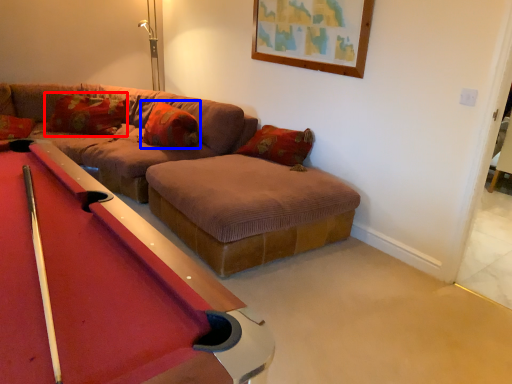
Question: Among these objects, which one is nearest to the camera, pillow (highlighted by a red box) or pillow (highlighted by a blue box)?

Choices:
 (A) pillow
 (B) pillow

Answer: (B)